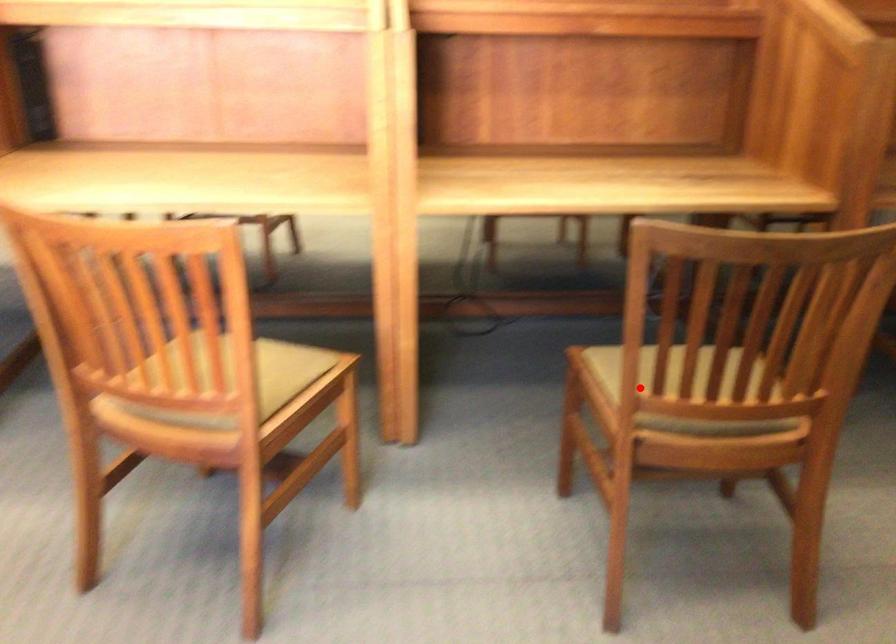
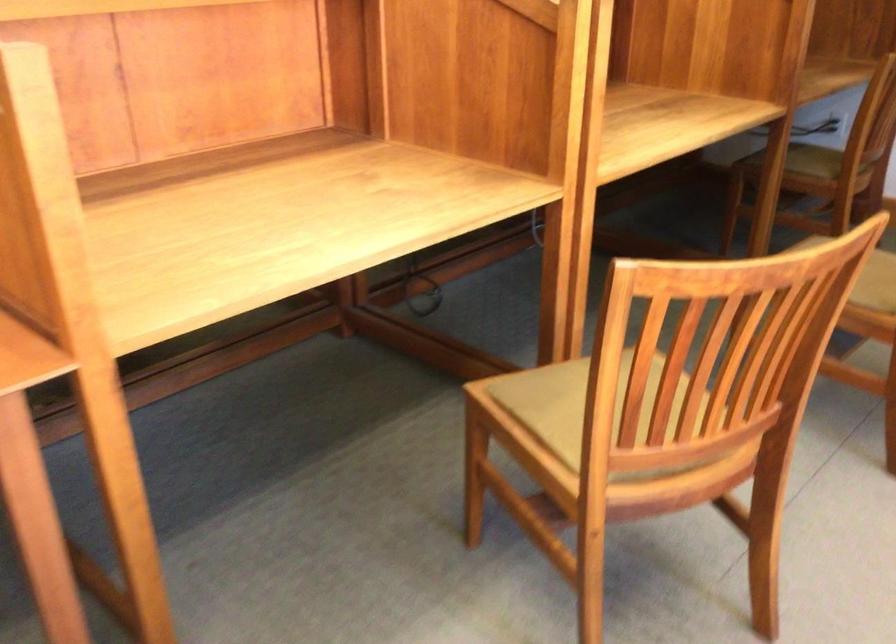
Question: I am providing you with two images of the same scene from different viewpoints. A red point is shown in image1. For the corresponding object point in image2, is it positioned nearer or farther from the camera?

Choices:
 (A) Nearer
 (B) Farther

Answer: (B)